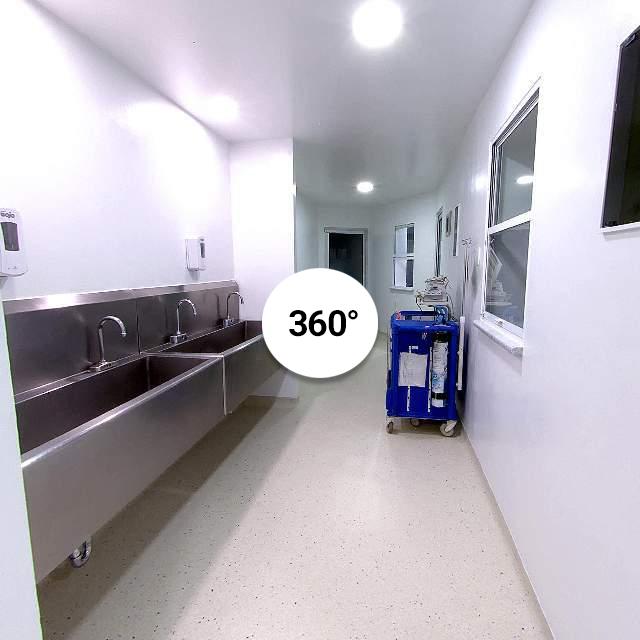
Locate an element on the screen. Image resolution: width=640 pixels, height=640 pixels. picture on wall is located at coordinates (630, 198).